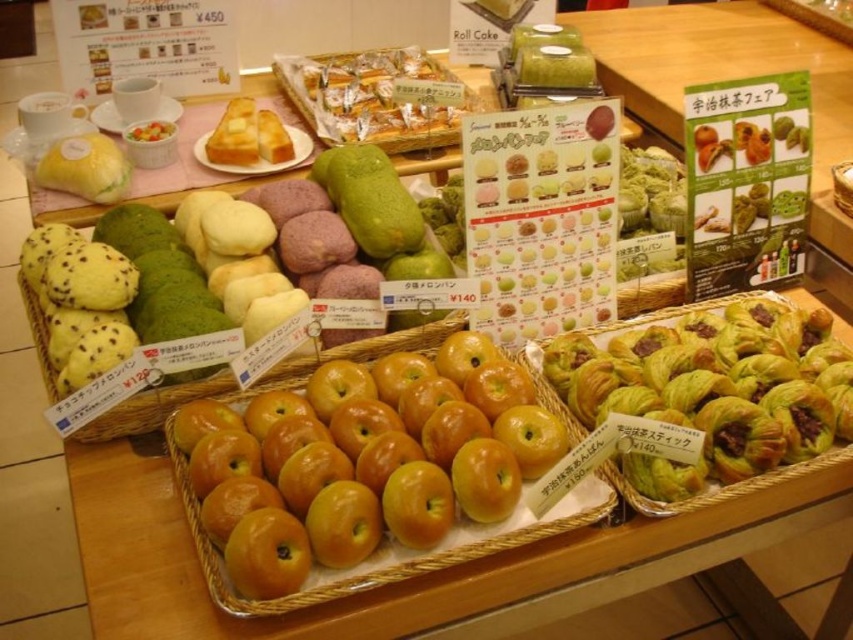
Who is positioned more to the right, yellow matte apples at center or green flaky pastry at lower right?

Positioned to the right is green flaky pastry at lower right.

Which is in front, point (509, 436) or point (631, 365)?

Point (509, 436) is in front.

The width and height of the screenshot is (853, 640). What are the coordinates of `yellow matte apples at center` in the screenshot? It's located at (363, 460).

Is yellow matte apples at center positioned before golden-brown crispy pastry at center?

Yes, it is.

Who is positioned more to the right, yellow matte apples at center or golden-brown crispy pastry at center?

Positioned to the right is yellow matte apples at center.

You are a GUI agent. You are given a task and a screenshot of the screen. Output one action in this format:
    pyautogui.click(x=<x>, y=<y>)
    Task: Click on the yellow matte apples at center
    This screenshot has width=853, height=640.
    Given the screenshot: What is the action you would take?
    pyautogui.click(x=363, y=460)

Can you confirm if green flaky pastry at lower right is positioned above golden-brown crispy pastry at center?

No, green flaky pastry at lower right is not above golden-brown crispy pastry at center.

Is point (793, 417) closer to viewer compared to point (355, 52)?

That is True.

Where is `green flaky pastry at lower right`? The image size is (853, 640). green flaky pastry at lower right is located at coordinates (709, 394).

Where is `green flaky pastry at lower right`? green flaky pastry at lower right is located at coordinates (709, 394).